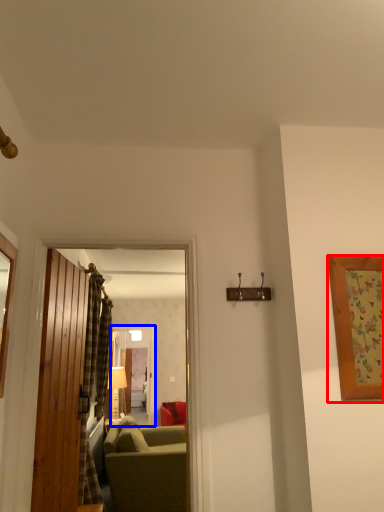
Question: Among these objects, which one is nearest to the camera, picture frame (highlighted by a red box) or glass door (highlighted by a blue box)?

Choices:
 (A) picture frame
 (B) glass door

Answer: (A)